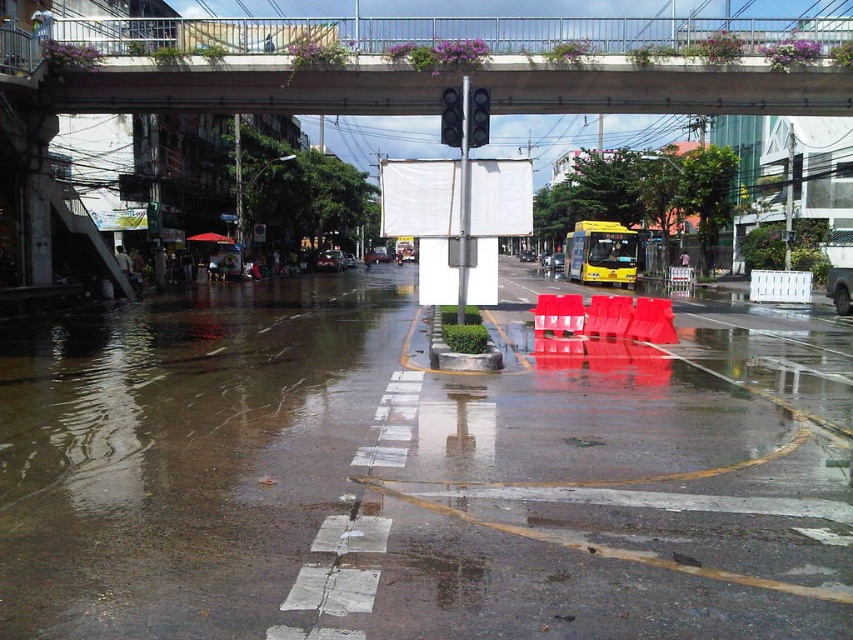
You are a delivery driver approaching an intersection with two traffic lights. You see the black glass traffic light at upper center and the black plastic traffic light at center. Which traffic light should you pay attention to first?

You should pay attention to the black glass traffic light at upper center first because it is closer to you than the black plastic traffic light at center.

Looking at this image, you are standing at the pedestrian crossing and want to walk to the traffic signal pole. There are two points marked on the road, point 1 at coordinates point (x=287, y=348) and point 2 at coordinates point (x=595, y=228). Which point is closer to you as you stand at the pedestrian crossing?

Point (x=287, y=348) is closer to the viewer than point (x=595, y=228), so the closer point to you is point (x=287, y=348).